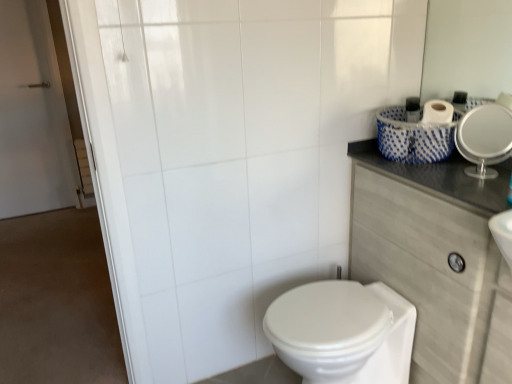
Where is `dark gray laminate counter top at upper right`? The height and width of the screenshot is (384, 512). dark gray laminate counter top at upper right is located at coordinates (429, 252).

Where is `white glossy bidet at lower center`? white glossy bidet at lower center is located at coordinates (343, 332).

Consider the image. Do you think white glossy bidet at lower center is within white glossy mirror at upper right, or outside of it?

white glossy bidet at lower center is not enclosed by white glossy mirror at upper right.

Between point (328, 321) and point (490, 125), which one is positioned behind?

Point (490, 125)

From a real-world perspective, is white glossy bidet at lower center located higher than white glossy mirror at upper right?

No.

Is white glossy bidet at lower center in front of or behind white glossy mirror at upper right in the image?

Clearly, white glossy bidet at lower center is in front of white glossy mirror at upper right.

Is dark gray laminate counter top at upper right touching white glossy mirror at upper right?

No, dark gray laminate counter top at upper right is not beside white glossy mirror at upper right.

Does point (465, 197) appear closer or farther from the camera than point (467, 133)?

Point (465, 197).

Is dark gray laminate counter top at upper right facing away from white glossy mirror at upper right?

No, white glossy mirror at upper right is not at the back of dark gray laminate counter top at upper right.

From the image's perspective, is dark gray laminate counter top at upper right below white glossy mirror at upper right?

Yes, from the image's perspective, dark gray laminate counter top at upper right is beneath white glossy mirror at upper right.

Between point (321, 323) and point (409, 260), which one is positioned in front?

The point (321, 323) is closer.

Considering the relative sizes of white glossy bidet at lower center and dark gray laminate counter top at upper right in the image provided, is white glossy bidet at lower center shorter than dark gray laminate counter top at upper right?

Indeed, white glossy bidet at lower center has a lesser height compared to dark gray laminate counter top at upper right.

Does white glossy bidet at lower center appear on the right side of dark gray laminate counter top at upper right?

No.

Locate an element on the screen. Image resolution: width=512 pixels, height=384 pixels. bidet that is below the dark gray laminate counter top at upper right (from the image's perspective) is located at coordinates (343, 332).

In the scene shown: Is white glossy mirror at upper right directly adjacent to white glossy bidet at lower center?

white glossy mirror at upper right and white glossy bidet at lower center are clearly separated.

Is white glossy mirror at upper right oriented away from white glossy bidet at lower center?

No.

Considering the relative sizes of white glossy mirror at upper right and white glossy bidet at lower center in the image provided, is white glossy mirror at upper right thinner than white glossy bidet at lower center?

Indeed, white glossy mirror at upper right has a lesser width compared to white glossy bidet at lower center.

From a real-world perspective, who is located lower, dark gray laminate counter top at upper right or white glossy bidet at lower center?

In real-world perspective, white glossy bidet at lower center is lower.

Between dark gray laminate counter top at upper right and white glossy bidet at lower center, which one has less height?

white glossy bidet at lower center is shorter.

Find the location of a particular element. This screenshot has height=384, width=512. bidet that is under the dark gray laminate counter top at upper right (from a real-world perspective) is located at coordinates (343, 332).

Is dark gray laminate counter top at upper right facing towards white glossy bidet at lower center?

Yes, dark gray laminate counter top at upper right is turned towards white glossy bidet at lower center.

Is white glossy mirror at upper right inside or outside of dark gray laminate counter top at upper right?

white glossy mirror at upper right is spatially situated outside dark gray laminate counter top at upper right.

Between point (479, 170) and point (419, 381), which one is positioned behind?

The point (419, 381) is behind.

Between white glossy mirror at upper right and dark gray laminate counter top at upper right, which one has smaller width?

white glossy mirror at upper right.

Considering the positions of objects white glossy mirror at upper right and dark gray laminate counter top at upper right in the image provided, who is in front, white glossy mirror at upper right or dark gray laminate counter top at upper right?

dark gray laminate counter top at upper right.

The width and height of the screenshot is (512, 384). In order to click on bidet below the white glossy mirror at upper right (from the image's perspective) in this screenshot , I will do `click(343, 332)`.

Where is `mirror that appears above the dark gray laminate counter top at upper right (from the image's perspective)`? mirror that appears above the dark gray laminate counter top at upper right (from the image's perspective) is located at coordinates (484, 138).

Considering their positions, is dark gray laminate counter top at upper right positioned further to white glossy mirror at upper right than white glossy bidet at lower center?

Based on the image, white glossy bidet at lower center appears to be further to white glossy mirror at upper right.

Which object lies nearer to the anchor point white glossy bidet at lower center, dark gray laminate counter top at upper right or white glossy mirror at upper right?

Among the two, dark gray laminate counter top at upper right is located nearer to white glossy bidet at lower center.

Looking at the image, which one is located further to white glossy bidet at lower center, white glossy mirror at upper right or dark gray laminate counter top at upper right?

white glossy mirror at upper right lies further to white glossy bidet at lower center than the other object.

Considering their positions, is white glossy mirror at upper right positioned further to dark gray laminate counter top at upper right than white glossy bidet at lower center?

white glossy mirror at upper right.

From the image, which object appears to be farther from white glossy mirror at upper right, white glossy bidet at lower center or dark gray laminate counter top at upper right?

white glossy bidet at lower center is further to white glossy mirror at upper right.

When comparing their distances from dark gray laminate counter top at upper right, does white glossy bidet at lower center or white glossy mirror at upper right seem further?

Among the two, white glossy mirror at upper right is located further to dark gray laminate counter top at upper right.

I want to click on counter top between white glossy mirror at upper right and white glossy bidet at lower center in the up-down direction, so click(x=429, y=252).